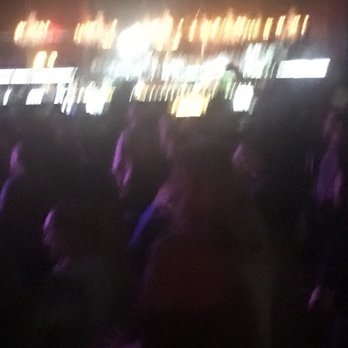
I want to click on white light, so click(301, 62).